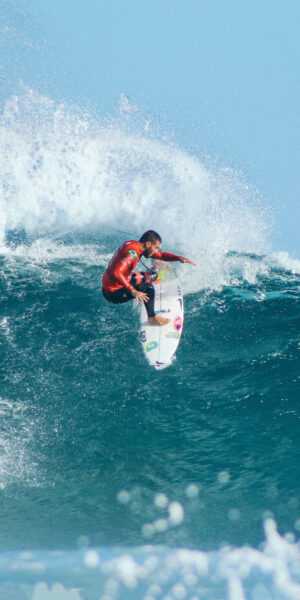
Locate an element on the screen. foam is located at coordinates (60, 178), (108, 154), (142, 184), (184, 174), (225, 195).